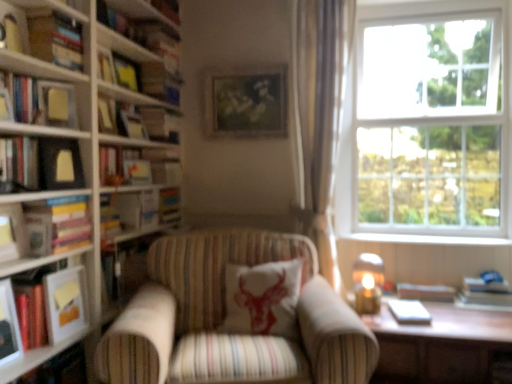
This screenshot has height=384, width=512. What are the coordinates of `unoccupied area in front of matte glass candle at right` in the screenshot? It's located at (380, 319).